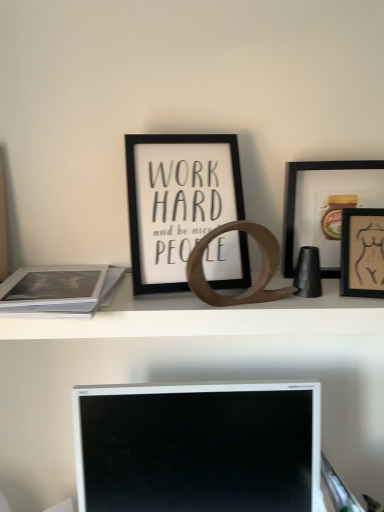
Where is `matte black picture frame at upper right, the 1th picture frame from the right`? Image resolution: width=384 pixels, height=512 pixels. matte black picture frame at upper right, the 1th picture frame from the right is located at coordinates (362, 253).

What do you see at coordinates (57, 291) in the screenshot? This screenshot has height=512, width=384. I see `white matte paper at left` at bounding box center [57, 291].

Where is `wooden ring at center`? wooden ring at center is located at coordinates (208, 318).

What is the approximate height of black matte picture frame at center, the 3th picture frame from the right?

black matte picture frame at center, the 3th picture frame from the right, is 12.26 inches in height.

Locate an element on the screen. matte black picture frame at right, acting as the 2th picture frame starting from the right is located at coordinates (325, 206).

Starting from the matte black picture frame at upper right, the 1th picture frame from the right, which picture frame is the 1st one to the left? Please provide its 2D coordinates.

[(325, 206)]

Does matte black picture frame at upper right, the 1th picture frame from the right, appear on the left side of matte black picture frame at right, acting as the 2th picture frame starting from the right?

No, matte black picture frame at upper right, the 1th picture frame from the right, is not to the left of matte black picture frame at right, acting as the 2th picture frame starting from the right.

Looking at this image, from the image's perspective, is matte black picture frame at upper right, the 3th picture frame from the left, located above matte black picture frame at right, arranged as the second picture frame when viewed from the left?

Incorrect, from the image's perspective, matte black picture frame at upper right, the 3th picture frame from the left, is lower than matte black picture frame at right, arranged as the second picture frame when viewed from the left.

Is matte black picture frame at upper right, the 1th picture frame from the right, shorter than matte black picture frame at right, arranged as the second picture frame when viewed from the left?

Yes.

From the image's perspective, would you say matte black picture frame at upper right, the 3th picture frame from the left, is shown under black matte picture frame at center, the 3th picture frame from the right?

Indeed, from the image's perspective, matte black picture frame at upper right, the 3th picture frame from the left, is shown beneath black matte picture frame at center, the 3th picture frame from the right.

Considering the relative sizes of matte black picture frame at upper right, the 1th picture frame from the right, and black matte picture frame at center, which appears as the first picture frame when viewed from the left, in the image provided, is matte black picture frame at upper right, the 1th picture frame from the right, smaller than black matte picture frame at center, which appears as the first picture frame when viewed from the left,?

Yes, matte black picture frame at upper right, the 1th picture frame from the right, is smaller than black matte picture frame at center, which appears as the first picture frame when viewed from the left.

Which is in front, matte black picture frame at upper right, the 1th picture frame from the right, or black matte picture frame at center, the 3th picture frame from the right?

matte black picture frame at upper right, the 1th picture frame from the right, is closer to the camera.

Is black matte picture frame at center, the 3th picture frame from the right, oriented towards white glossy computer monitor at center?

No, black matte picture frame at center, the 3th picture frame from the right, is not facing towards white glossy computer monitor at center.

At what (x,y) coordinates should I click in order to perform the action: click on picture frame that is the 3rd object located above the white glossy computer monitor at center (from the image's perspective). Please return your answer as a coordinate pair (x, y). Looking at the image, I should click on (177, 202).

From the image's perspective, is black matte picture frame at center, which appears as the first picture frame when viewed from the left, above white glossy computer monitor at center?

Indeed, from the image's perspective, black matte picture frame at center, which appears as the first picture frame when viewed from the left, is shown above white glossy computer monitor at center.

Considering the relative positions of black matte picture frame at center, which appears as the first picture frame when viewed from the left, and white glossy computer monitor at center in the image provided, is black matte picture frame at center, which appears as the first picture frame when viewed from the left, behind white glossy computer monitor at center?

That is False.

Is wooden ring at center wider or thinner than white glossy computer monitor at center?

wooden ring at center is wider than white glossy computer monitor at center.

The image size is (384, 512). In order to click on computer monitor that is behind the wooden ring at center in this screenshot , I will do `click(197, 447)`.

Is wooden ring at center facing towards white glossy computer monitor at center?

No, wooden ring at center is not facing towards white glossy computer monitor at center.

Looking at this image, which is farther from the camera, (163, 195) or (297, 232)?

Point (297, 232)

Would you consider black matte picture frame at center, which appears as the first picture frame when viewed from the left, to be distant from matte black picture frame at right, arranged as the second picture frame when viewed from the left?

No, black matte picture frame at center, which appears as the first picture frame when viewed from the left, is not far from matte black picture frame at right, arranged as the second picture frame when viewed from the left.

In the scene shown: Is black matte picture frame at center, the 3th picture frame from the right, oriented away from matte black picture frame at right, acting as the 2th picture frame starting from the right?

No, black matte picture frame at center, the 3th picture frame from the right,'s orientation is not away from matte black picture frame at right, acting as the 2th picture frame starting from the right.

Measure the distance from black matte picture frame at center, which appears as the first picture frame when viewed from the left, to matte black picture frame at right, arranged as the second picture frame when viewed from the left.

black matte picture frame at center, which appears as the first picture frame when viewed from the left, is 9.05 inches from matte black picture frame at right, arranged as the second picture frame when viewed from the left.

Which is closer to the camera, (280, 396) or (219, 165)?

The point (219, 165) is closer.

Is white glossy computer monitor at center outside of black matte picture frame at center, the 3th picture frame from the right?

That's correct, white glossy computer monitor at center is outside of black matte picture frame at center, the 3th picture frame from the right.

Could you tell me if white glossy computer monitor at center is turned towards black matte picture frame at center, the 3th picture frame from the right?

No, white glossy computer monitor at center is not facing towards black matte picture frame at center, the 3th picture frame from the right.

Between white glossy computer monitor at center and black matte picture frame at center, the 3th picture frame from the right, which one has less height?

With less height is black matte picture frame at center, the 3th picture frame from the right.

In the scene shown: Is the surface of matte black picture frame at right, acting as the 2th picture frame starting from the right, in direct contact with matte black picture frame at upper right, the 1th picture frame from the right?

They are not placed beside each other.

Is matte black picture frame at right, acting as the 2th picture frame starting from the right, outside of matte black picture frame at upper right, the 1th picture frame from the right?

That's correct, matte black picture frame at right, acting as the 2th picture frame starting from the right, is outside of matte black picture frame at upper right, the 1th picture frame from the right.

Between matte black picture frame at right, acting as the 2th picture frame starting from the right, and matte black picture frame at upper right, the 1th picture frame from the right, which one appears on the right side from the viewer's perspective?

matte black picture frame at upper right, the 1th picture frame from the right, is more to the right.

Identify the location of picture frame that is the 2nd one when counting forward from the matte black picture frame at right, acting as the 2th picture frame starting from the right. (362, 253).

There is a matte black picture frame at upper right, the 3th picture frame from the left. What are the coordinates of `the 2nd picture frame above it (from the image's perspective)` in the screenshot? It's located at coord(177,202).

Looking at this image, based on their spatial positions, is wooden ring at center or matte black picture frame at upper right, the 3th picture frame from the left, further from matte black picture frame at right, acting as the 2th picture frame starting from the right?

Based on the image, wooden ring at center appears to be further to matte black picture frame at right, acting as the 2th picture frame starting from the right.

Looking at the image, which one is located further to matte black picture frame at right, arranged as the second picture frame when viewed from the left, wooden ring at center or black matte picture frame at center, which appears as the first picture frame when viewed from the left?

The object further to matte black picture frame at right, arranged as the second picture frame when viewed from the left, is black matte picture frame at center, which appears as the first picture frame when viewed from the left.

Which object lies further to the anchor point matte black picture frame at upper right, the 1th picture frame from the right, white matte paper at left or white glossy computer monitor at center?

Among the two, white matte paper at left is located further to matte black picture frame at upper right, the 1th picture frame from the right.

From the image, which object appears to be farther from wooden ring at center, black matte picture frame at center, the 3th picture frame from the right, or matte black picture frame at right, arranged as the second picture frame when viewed from the left?

Among the two, matte black picture frame at right, arranged as the second picture frame when viewed from the left, is located further to wooden ring at center.

Looking at this image, based on their spatial positions, is white matte paper at left or matte black picture frame at upper right, the 3th picture frame from the left, further from black matte picture frame at center, the 3th picture frame from the right?

matte black picture frame at upper right, the 3th picture frame from the left, lies further to black matte picture frame at center, the 3th picture frame from the right, than the other object.

Looking at this image, which object lies nearer to the anchor point white glossy computer monitor at center, matte black picture frame at right, acting as the 2th picture frame starting from the right, or matte black picture frame at upper right, the 3th picture frame from the left?

Based on the image, matte black picture frame at right, acting as the 2th picture frame starting from the right, appears to be nearer to white glossy computer monitor at center.

Looking at the image, which one is located further to black matte picture frame at center, which appears as the first picture frame when viewed from the left, white matte paper at left or white glossy computer monitor at center?

The object further to black matte picture frame at center, which appears as the first picture frame when viewed from the left, is white glossy computer monitor at center.

Estimate the real-world distances between objects in this image. Which object is closer to wooden ring at center, white glossy computer monitor at center or matte black picture frame at upper right, the 1th picture frame from the right?

matte black picture frame at upper right, the 1th picture frame from the right, is positioned closer to the anchor wooden ring at center.

You are a GUI agent. You are given a task and a screenshot of the screen. Output one action in this format:
    pyautogui.click(x=<x>, y=<y>)
    Task: Click on the shelf located between white matte paper at left and matte black picture frame at upper right, the 3th picture frame from the left, in the left-right direction
    The image size is (384, 512).
    Given the screenshot: What is the action you would take?
    pyautogui.click(x=208, y=318)

Locate an element on the screen. This screenshot has height=512, width=384. picture frame between black matte picture frame at center, the 3th picture frame from the right, and matte black picture frame at upper right, the 3th picture frame from the left, in the horizontal direction is located at coordinates (325, 206).

This screenshot has height=512, width=384. I want to click on picture frame situated between white matte paper at left and matte black picture frame at right, acting as the 2th picture frame starting from the right, from left to right, so pos(177,202).

The width and height of the screenshot is (384, 512). Find the location of `shelf between white matte paper at left and black matte picture frame at center, the 3th picture frame from the right, from left to right`. shelf between white matte paper at left and black matte picture frame at center, the 3th picture frame from the right, from left to right is located at coordinates (208, 318).